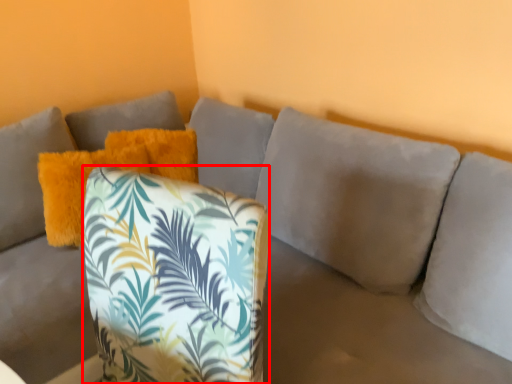
Question: Where is throw pillow (annotated by the red box) located in relation to pillow in the image?

Choices:
 (A) left
 (B) right

Answer: (B)